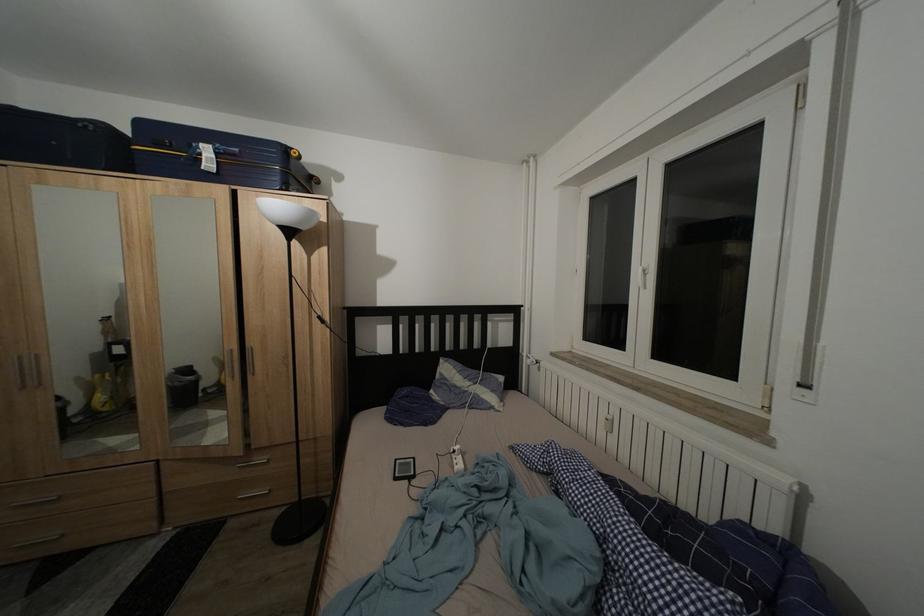
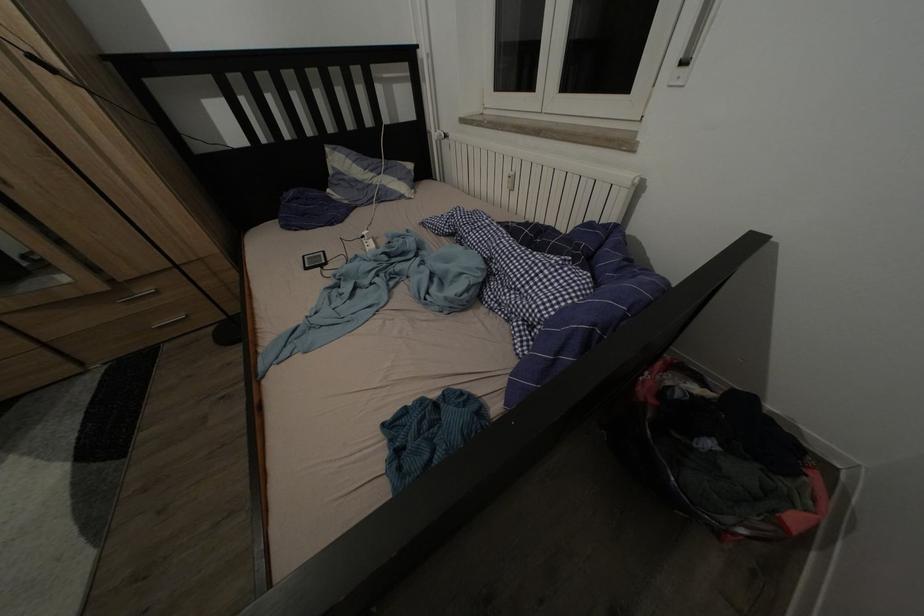
Find the pixel in the second image that matches point 465,454 in the first image.

(372, 238)